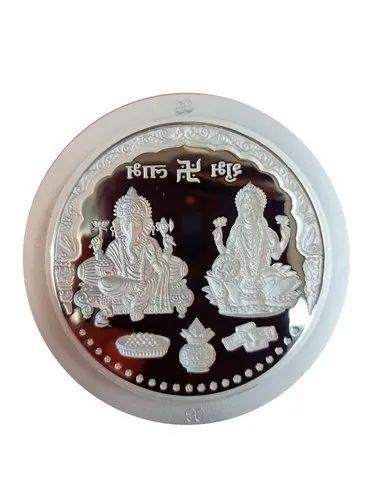
Image resolution: width=375 pixels, height=500 pixels. I want to click on chair, so click(174, 259), click(91, 290).